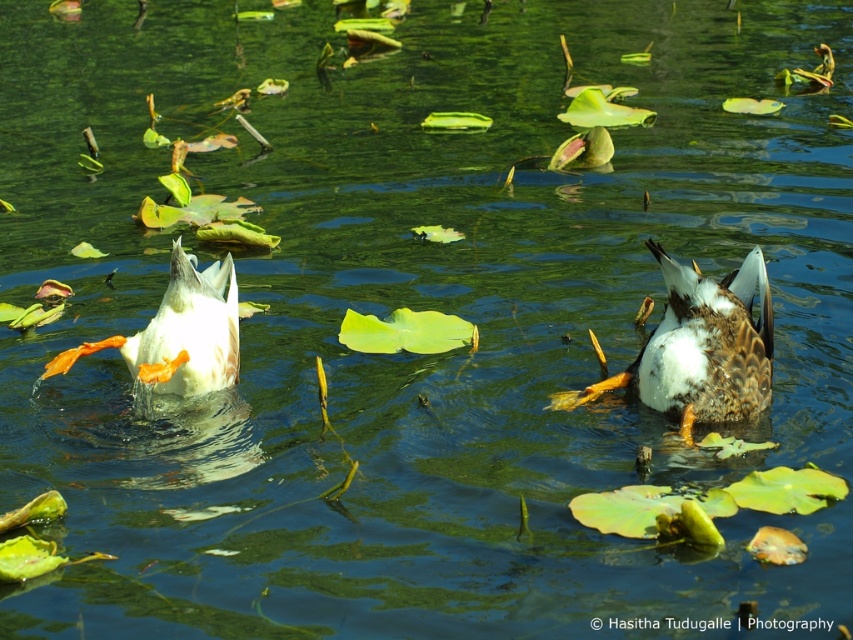
Consider the image. Does brown speckled duck at center have a greater height compared to white matte duck at left?

Indeed, brown speckled duck at center has a greater height compared to white matte duck at left.

Is point (730, 388) more distant than point (132, 339)?

No, (730, 388) is in front of (132, 339).

Which is behind, point (654, 364) or point (236, 305)?

Positioned behind is point (236, 305).

The image size is (853, 640). I want to click on brown speckled duck at center, so click(700, 348).